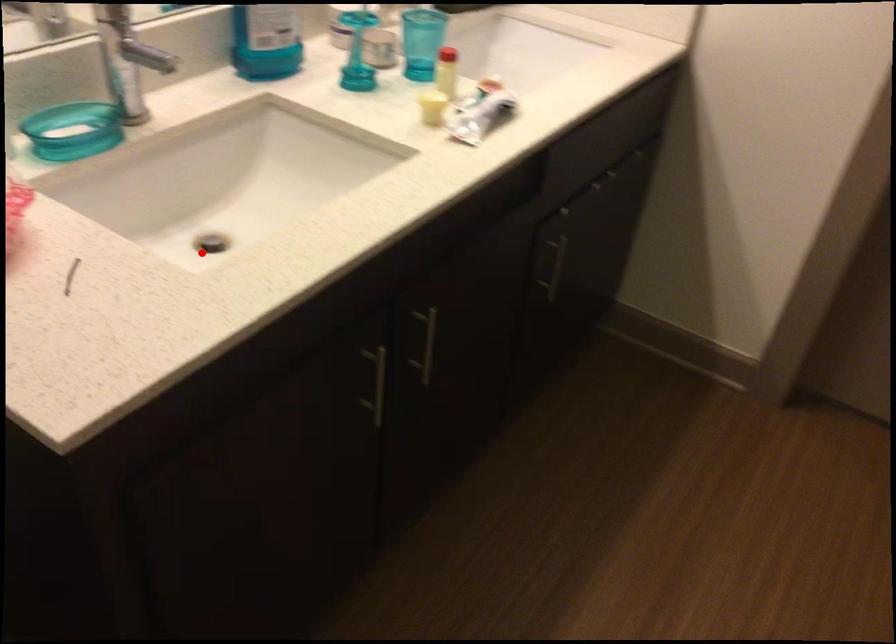
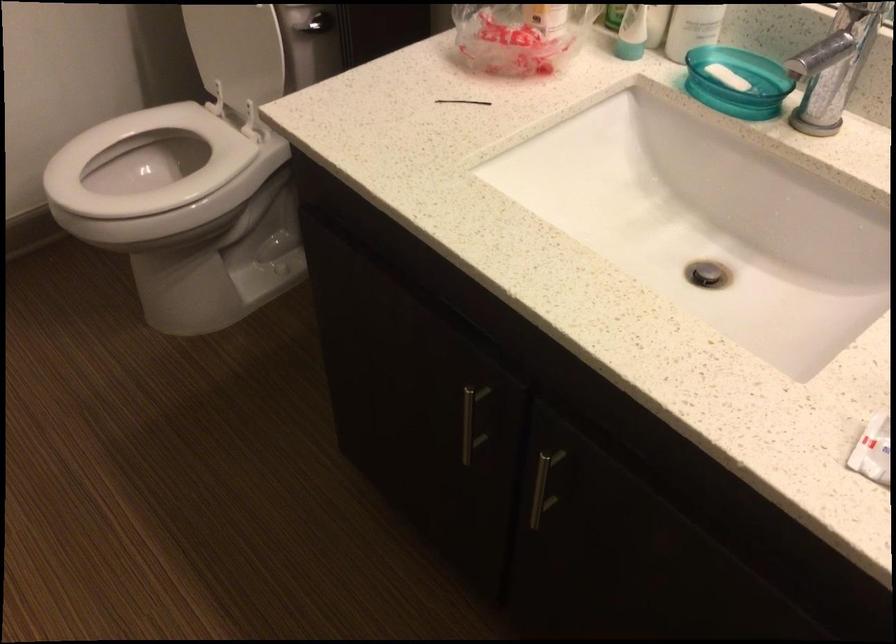
Find the pixel in the second image that matches the highlighted location in the first image.

(707, 274)